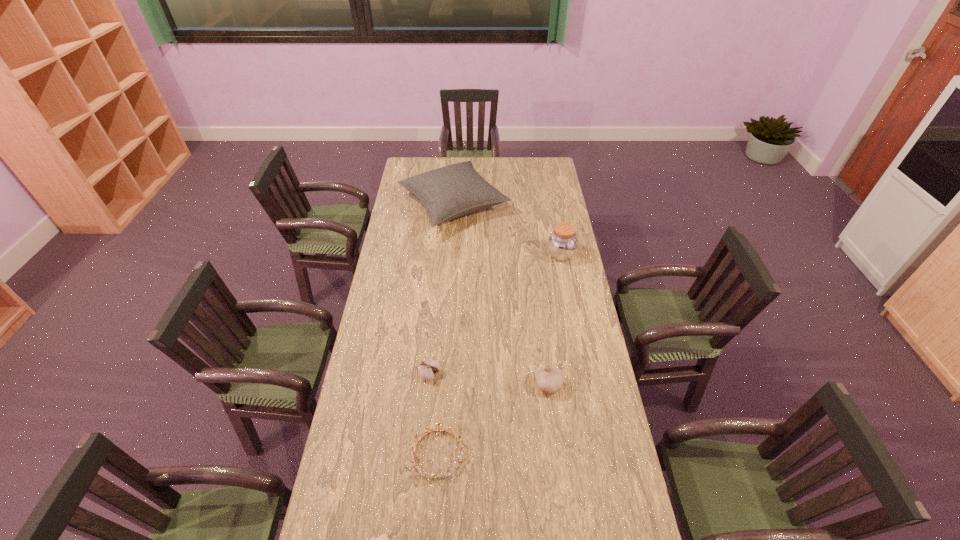
Find the location of a particular element. Image resolution: width=960 pixels, height=540 pixels. the tallest object is located at coordinates (449, 192).

At what (x,y) coordinates should I click in order to perform the action: click on the farthest object. Please return your answer as a coordinate pair (x, y). The image size is (960, 540). Looking at the image, I should click on (449, 192).

At what (x,y) coordinates should I click in order to perform the action: click on the second tallest object. Please return your answer as a coordinate pair (x, y). The width and height of the screenshot is (960, 540). Looking at the image, I should click on (562, 243).

Where is `the second farthest object`? Image resolution: width=960 pixels, height=540 pixels. the second farthest object is located at coordinates (562, 243).

This screenshot has height=540, width=960. Identify the location of the second object from right to left. (549, 378).

Locate an element on the screen. This screenshot has width=960, height=540. the left garlic is located at coordinates (427, 368).

You are a GUI agent. You are given a task and a screenshot of the screen. Output one action in this format:
    pyautogui.click(x=<x>, y=<y>)
    Task: Click on the fifth farthest object
    This screenshot has width=960, height=540.
    Given the screenshot: What is the action you would take?
    pyautogui.click(x=419, y=470)

Identify the location of the second shortest object. This screenshot has height=540, width=960. (419, 470).

Locate an element on the screen. The image size is (960, 540). vacant space situated 0.050m on the front of the tallest object is located at coordinates (450, 249).

Identify the location of free location located on the back of the jar. Image resolution: width=960 pixels, height=540 pixels. (558, 237).